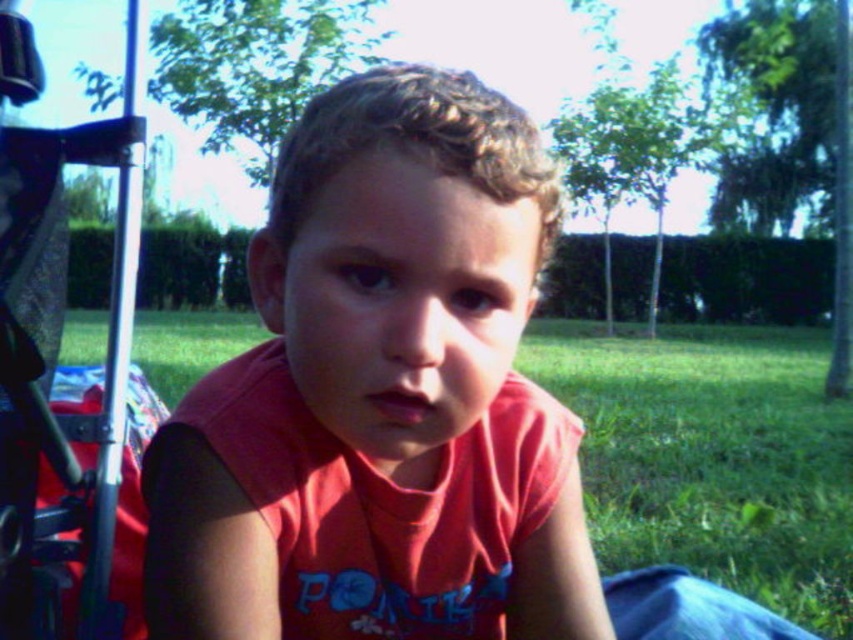
Is green grass at center to the right of metallic silver baby carriage at left from the viewer's perspective?

Indeed, green grass at center is positioned on the right side of metallic silver baby carriage at left.

Does green grass at center have a larger size compared to metallic silver baby carriage at left?

Yes, green grass at center is bigger than metallic silver baby carriage at left.

Locate an element on the screen. The width and height of the screenshot is (853, 640). green grass at center is located at coordinates (712, 456).

Can you confirm if matte red shirt at center is shorter than metallic silver baby carriage at left?

Indeed, matte red shirt at center has a lesser height compared to metallic silver baby carriage at left.

Is matte red shirt at center thinner than metallic silver baby carriage at left?

No.

Where is `matte red shirt at center`? This screenshot has width=853, height=640. matte red shirt at center is located at coordinates (381, 396).

I want to click on matte red shirt at center, so click(x=381, y=396).

In the scene shown: Does matte red shirt at center appear on the left side of green grass at center?

Indeed, matte red shirt at center is positioned on the left side of green grass at center.

Is point (335, 208) behind point (775, 496)?

No, it is not.

Describe the element at coordinates (381, 396) in the screenshot. I see `matte red shirt at center` at that location.

Where is `matte red shirt at center`? matte red shirt at center is located at coordinates (381, 396).